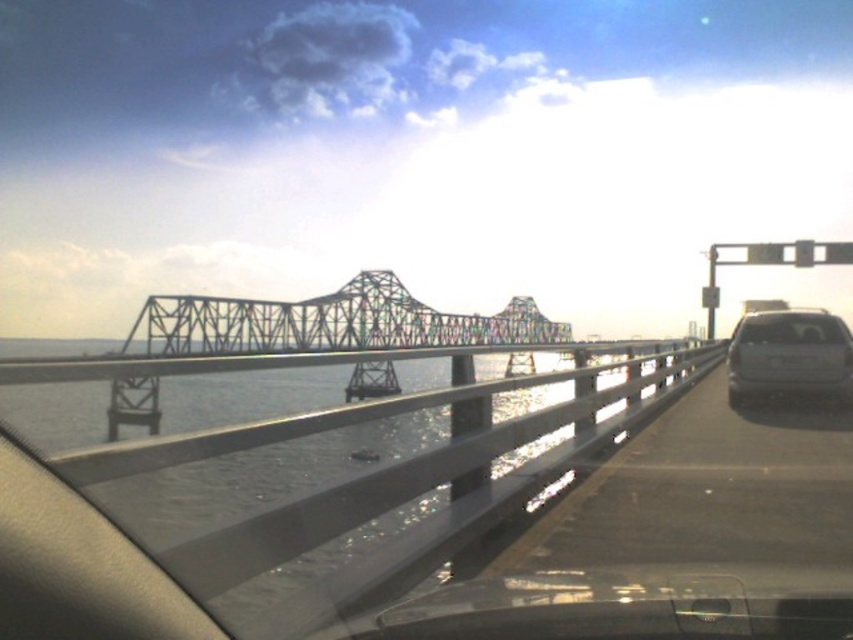
Question: Among these objects, which one is farthest from the camera?

Choices:
 (A) satin silver sedan at right
 (B) metallic bridge at center
 (C) clear water at bridge center

Answer: (A)

Question: Which is farther from the clear water at bridge center?

Choices:
 (A) satin silver sedan at right
 (B) metallic bridge at center

Answer: (B)

Question: Can you confirm if metallic bridge at center is positioned to the right of satin silver sedan at right?

Choices:
 (A) yes
 (B) no

Answer: (B)

Question: Can you confirm if clear water at bridge center is positioned to the left of metallic bridge at center?

Choices:
 (A) no
 (B) yes

Answer: (A)

Question: Which of the following is the closest to the observer?

Choices:
 (A) metallic bridge at center
 (B) satin silver sedan at right
 (C) clear water at bridge center

Answer: (C)

Question: Can you confirm if clear water at bridge center is bigger than metallic bridge at center?

Choices:
 (A) no
 (B) yes

Answer: (A)